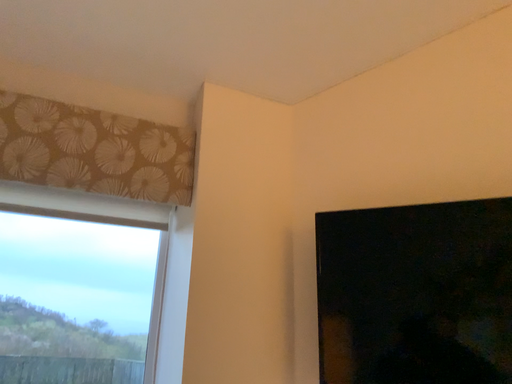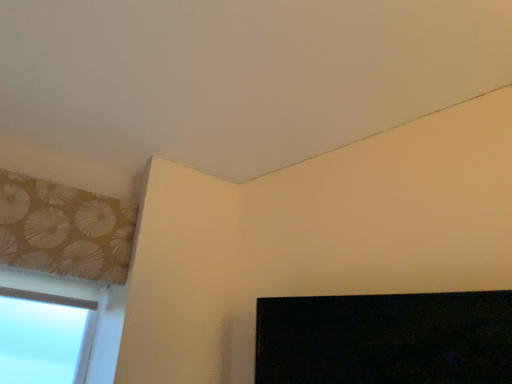
Question: Which way did the camera rotate in the video?

Choices:
 (A) rotated left
 (B) rotated right

Answer: (B)